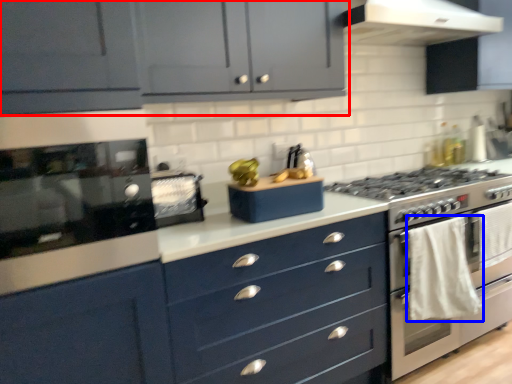
Question: Among these objects, which one is nearest to the camera, cabinetry (highlighted by a red box) or material (highlighted by a blue box)?

Choices:
 (A) cabinetry
 (B) material

Answer: (A)